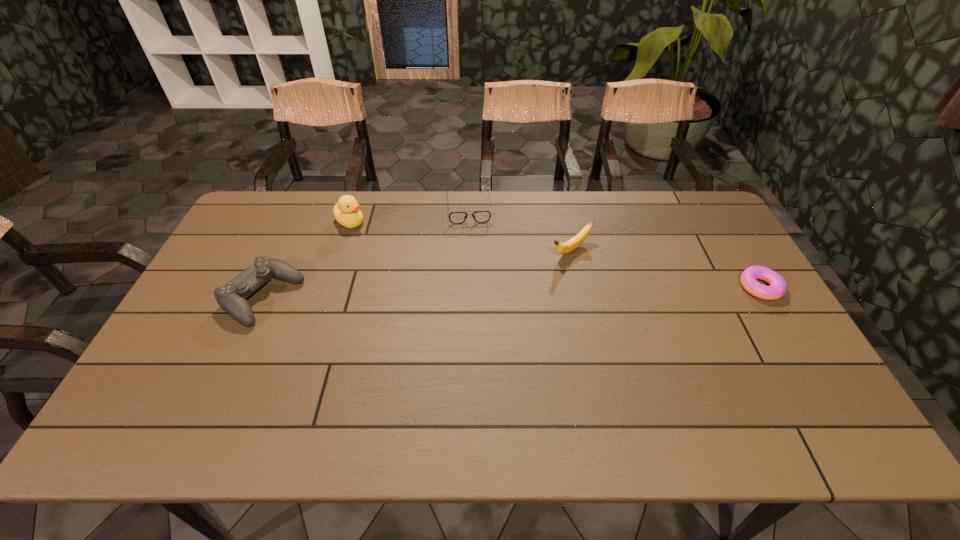
Where is `free point located 0.070m on the face of the fourth object from right to left`? This screenshot has height=540, width=960. free point located 0.070m on the face of the fourth object from right to left is located at coordinates (372, 238).

Locate an element on the screen. The image size is (960, 540). sunglasses located in the far edge section of the desktop is located at coordinates (479, 216).

Find the location of a particular element. duckling present at the far edge is located at coordinates (347, 212).

Where is `object located in the left edge section of the desktop`? This screenshot has height=540, width=960. object located in the left edge section of the desktop is located at coordinates (232, 297).

At what (x,y) coordinates should I click in order to perform the action: click on object at the right edge. Please return your answer as a coordinate pair (x, y). Looking at the image, I should click on (777, 288).

The width and height of the screenshot is (960, 540). In the image, there is a desktop. Identify the location of vacant space at the far edge. (367, 198).

This screenshot has width=960, height=540. Identify the location of vacant space at the near edge of the desktop. (244, 374).

In the image, there is a desktop. Where is `vacant area at the left edge`? The width and height of the screenshot is (960, 540). vacant area at the left edge is located at coordinates pos(242,249).

You are a GUI agent. You are given a task and a screenshot of the screen. Output one action in this format:
    pyautogui.click(x=<x>, y=<y>)
    Task: Click on the free space at the right edge of the desktop
    
    Given the screenshot: What is the action you would take?
    pyautogui.click(x=700, y=252)

At what (x,y) coordinates should I click in order to perform the action: click on vacant space at the near left corner of the desktop. Please return your answer as a coordinate pair (x, y). The width and height of the screenshot is (960, 540). Looking at the image, I should click on (156, 384).